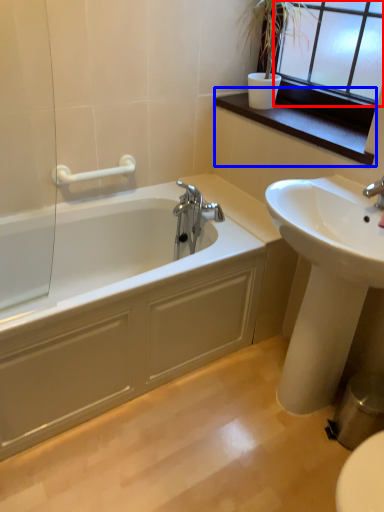
Question: Which object is closer to the camera taking this photo, window frame (highlighted by a red box) or window sill (highlighted by a blue box)?

Choices:
 (A) window frame
 (B) window sill

Answer: (A)